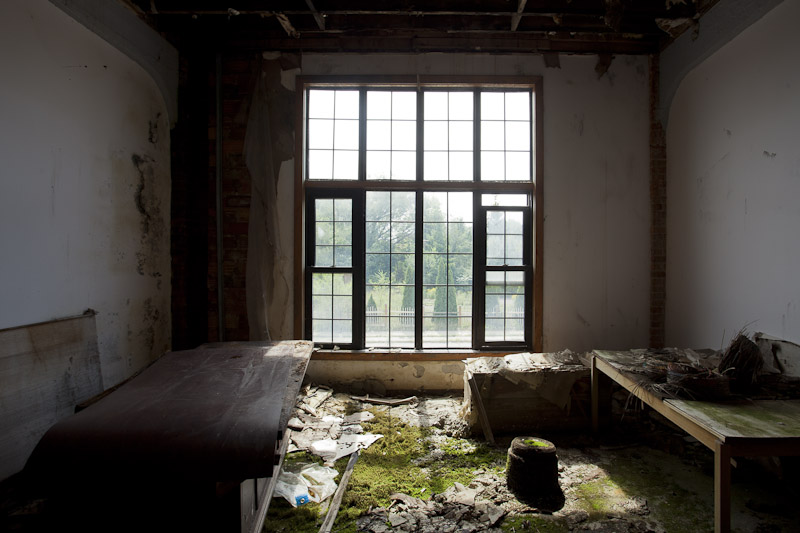
Image resolution: width=800 pixels, height=533 pixels. Find the location of `light`. light is located at coordinates (453, 155).